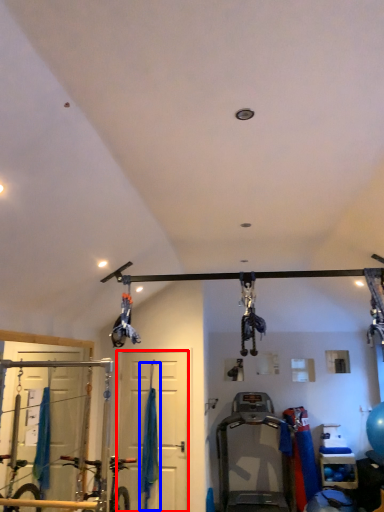
Question: Which point is further to the camera, door (highlighted by a red box) or curtain (highlighted by a blue box)?

Choices:
 (A) door
 (B) curtain

Answer: (A)